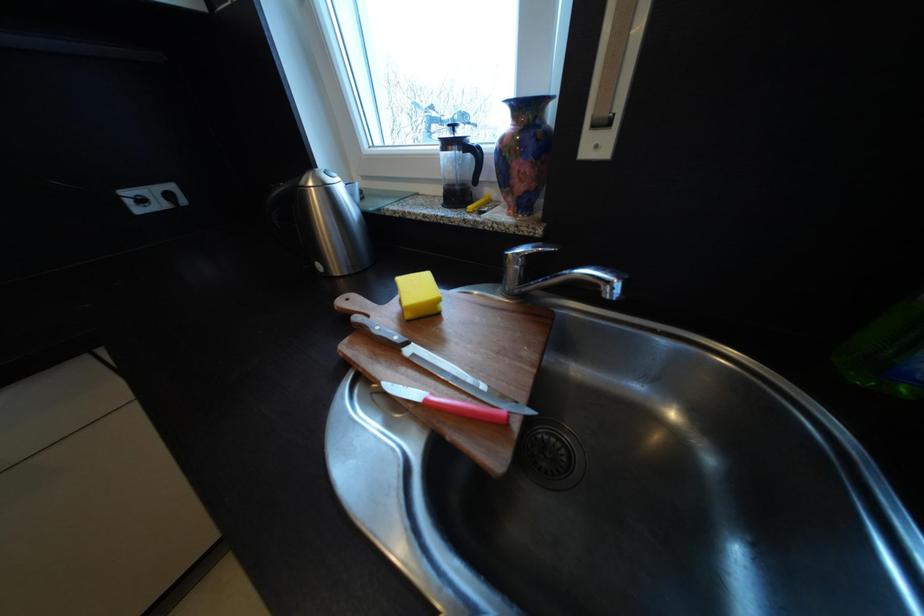
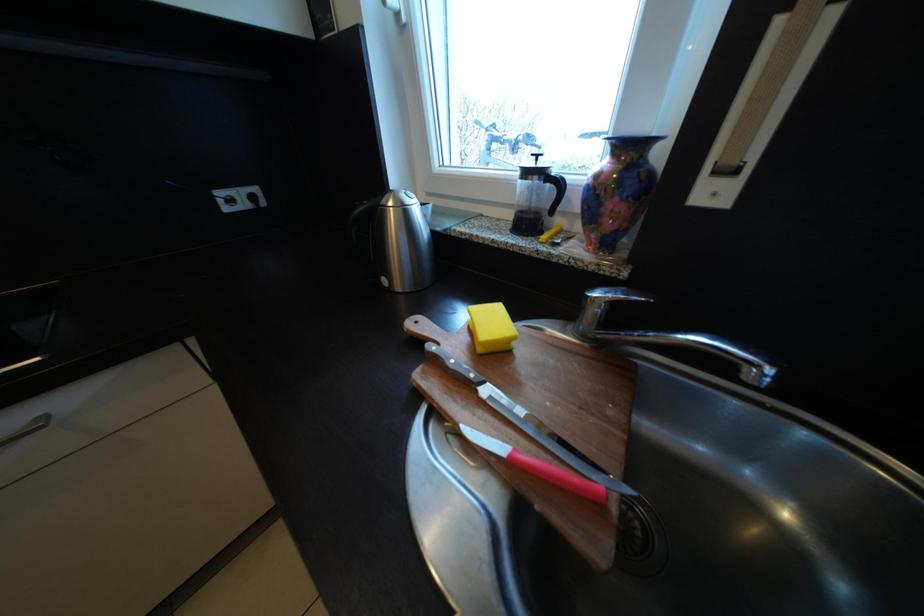
Question: The camera is either moving clockwise (left) or counter-clockwise (right) around the object. The first image is from the beginning of the video and the second image is from the end. Is the camera moving left or right when shooting the video?

Choices:
 (A) Left
 (B) Right

Answer: (B)